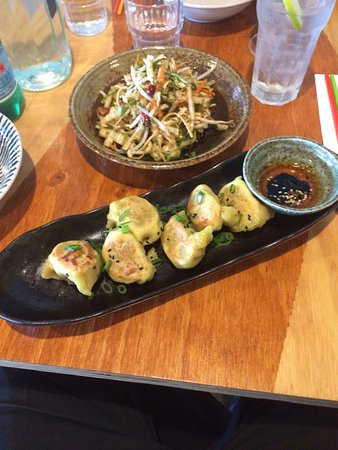
What are the coordinates of `oval shape plate that is holding dumplings` in the screenshot? It's located at (43, 296).